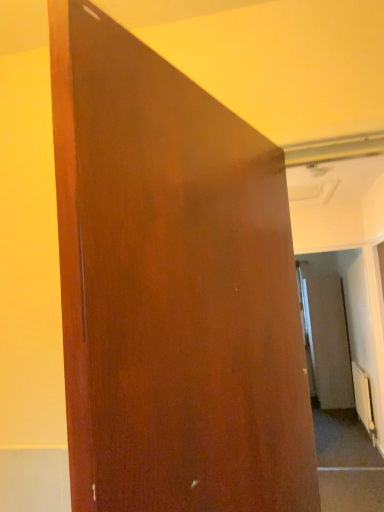
Question: Does matte brown screen door at right appear on the right side of white metallic radiator at lower right?

Choices:
 (A) yes
 (B) no

Answer: (A)

Question: Is matte brown screen door at right beside white metallic radiator at lower right?

Choices:
 (A) no
 (B) yes

Answer: (A)

Question: From a real-world perspective, is matte brown screen door at right beneath white metallic radiator at lower right?

Choices:
 (A) yes
 (B) no

Answer: (B)

Question: Does matte brown screen door at right have a greater height compared to white metallic radiator at lower right?

Choices:
 (A) no
 (B) yes

Answer: (B)

Question: Is matte brown screen door at right thinner than white metallic radiator at lower right?

Choices:
 (A) yes
 (B) no

Answer: (B)

Question: Is white metallic radiator at lower right a part of matte brown screen door at right?

Choices:
 (A) no
 (B) yes

Answer: (A)

Question: From a real-world perspective, does white metallic radiator at lower right stand above matte brown screen door at right?

Choices:
 (A) no
 (B) yes

Answer: (A)

Question: Is white metallic radiator at lower right taller than matte brown screen door at right?

Choices:
 (A) yes
 (B) no

Answer: (B)

Question: Is white metallic radiator at lower right to the right of matte brown screen door at right from the viewer's perspective?

Choices:
 (A) no
 (B) yes

Answer: (A)

Question: Can you confirm if white metallic radiator at lower right is positioned to the left of matte brown screen door at right?

Choices:
 (A) no
 (B) yes

Answer: (B)

Question: Does white metallic radiator at lower right have a smaller size compared to matte brown screen door at right?

Choices:
 (A) yes
 (B) no

Answer: (A)

Question: Considering the relative sizes of white metallic radiator at lower right and matte brown screen door at right in the image provided, is white metallic radiator at lower right wider than matte brown screen door at right?

Choices:
 (A) yes
 (B) no

Answer: (B)

Question: Is matte wood door at center directly adjacent to matte brown screen door at right?

Choices:
 (A) yes
 (B) no

Answer: (B)